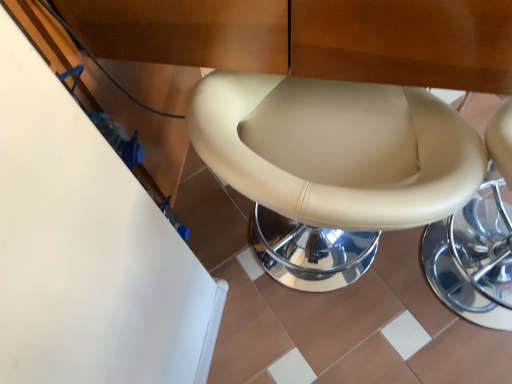
Question: Do you think beige leather bar stool at center is within beige leather toilet at center, or outside of it?

Choices:
 (A) outside
 (B) inside

Answer: (A)

Question: From a real-world perspective, relative to beige leather toilet at center, is beige leather bar stool at center vertically above or below?

Choices:
 (A) below
 (B) above

Answer: (A)

Question: Is point (490, 165) closer or farther from the camera than point (288, 102)?

Choices:
 (A) farther
 (B) closer

Answer: (B)

Question: Based on their sizes in the image, would you say beige leather toilet at center is bigger or smaller than beige leather bar stool at center?

Choices:
 (A) small
 (B) big

Answer: (B)

Question: Is beige leather toilet at center in front of or behind beige leather bar stool at center in the image?

Choices:
 (A) front
 (B) behind

Answer: (A)

Question: Is beige leather toilet at center spatially inside beige leather bar stool at center, or outside of it?

Choices:
 (A) outside
 (B) inside

Answer: (A)

Question: From a real-world perspective, is beige leather toilet at center physically located above or below beige leather bar stool at center?

Choices:
 (A) above
 (B) below

Answer: (A)